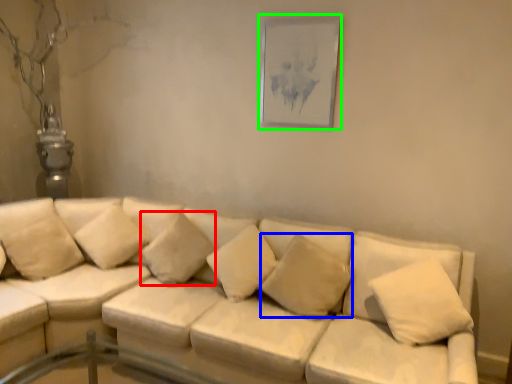
Question: Which is farther away from pillow (highlighted by a red box)? pillow (highlighted by a blue box) or picture frame (highlighted by a green box)?

Choices:
 (A) pillow
 (B) picture frame

Answer: (B)